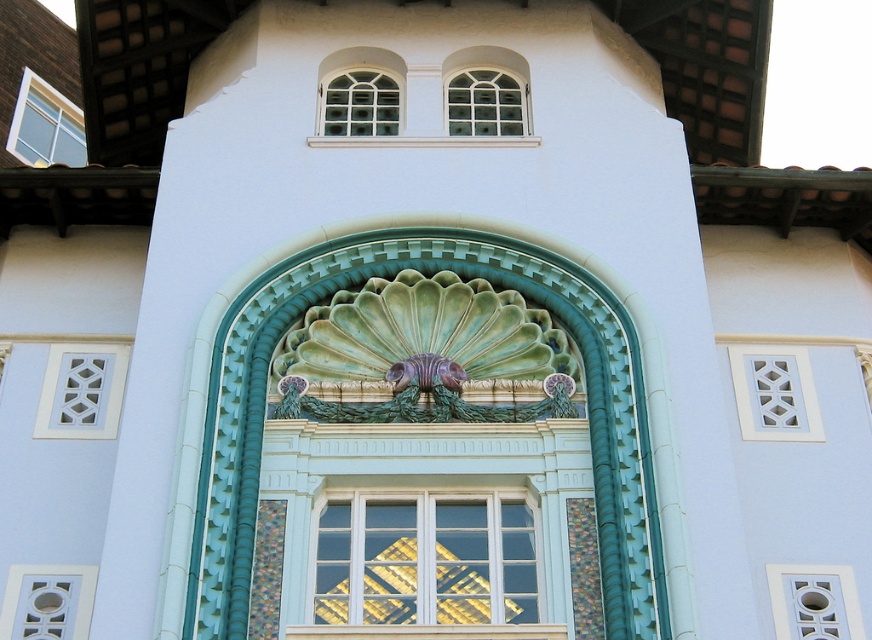
Is green ceramic scallop shell at center below white glass window at center?

Incorrect, green ceramic scallop shell at center is not positioned below white glass window at center.

The image size is (872, 640). What do you see at coordinates (392, 278) in the screenshot?
I see `green ceramic scallop shell at center` at bounding box center [392, 278].

Does point (530, 282) come behind point (409, 570)?

Yes, point (530, 282) is farther from viewer.

In order to click on green ceramic scallop shell at center in this screenshot , I will do `click(392, 278)`.

Does white lattice at center appear under matte glass window at upper left?

Yes.

Between white lattice at center and matte glass window at upper left, which one has less height?

Standing shorter between the two is white lattice at center.

Is point (782, 374) more distant than point (26, 90)?

No, it is in front of (26, 90).

You are a GUI agent. You are given a task and a screenshot of the screen. Output one action in this format:
    pyautogui.click(x=<x>, y=<y>)
    Task: Click on the white lattice at center
    Image resolution: width=872 pixels, height=640 pixels.
    Given the screenshot: What is the action you would take?
    pyautogui.click(x=774, y=394)

Describe the element at coordinates (426, 560) in the screenshot. I see `white glass window at center` at that location.

Between white glass window at center and white lattice at lower right, which one appears on the right side from the viewer's perspective?

Positioned to the right is white lattice at lower right.

Is point (380, 499) closer to viewer compared to point (816, 577)?

That is True.

What are the coordinates of `white glass window at center` in the screenshot? It's located at (426, 560).